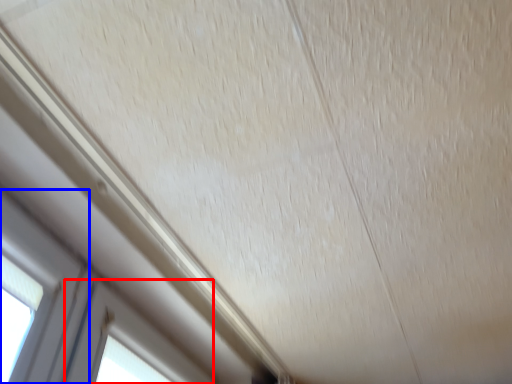
Question: Which object is closer to the camera taking this photo, window (highlighted by a red box) or window (highlighted by a blue box)?

Choices:
 (A) window
 (B) window

Answer: (B)